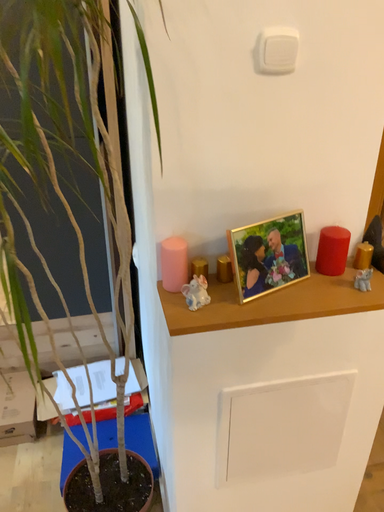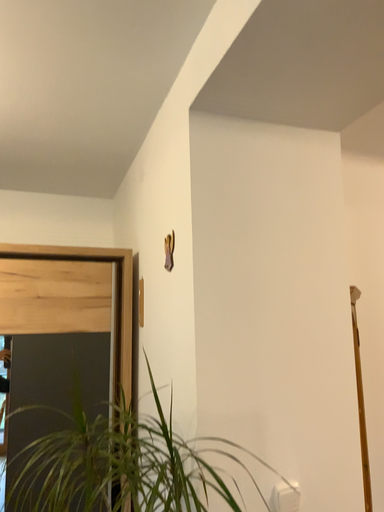
Question: Which way did the camera rotate in the video?

Choices:
 (A) rotated upward
 (B) rotated downward

Answer: (A)